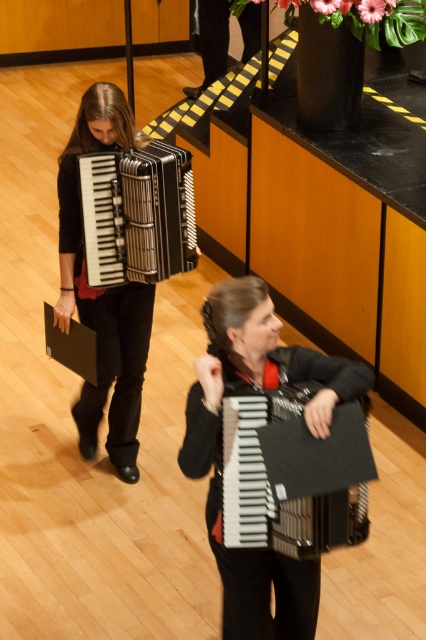
Question: Can you confirm if black matte accordion at center is bigger than matte black accordion at left?

Choices:
 (A) yes
 (B) no

Answer: (B)

Question: Among these objects, which one is nearest to the camera?

Choices:
 (A) black matte accordion at center
 (B) matte black accordion at left
 (C) matte black accordion at center
 (D) metallic silver accordion at center

Answer: (A)

Question: Does black matte accordion at center appear on the left side of metallic silver accordion at center?

Choices:
 (A) yes
 (B) no

Answer: (B)

Question: Which point is closer to the camera taking this photo?

Choices:
 (A) (192, 212)
 (B) (126, 451)
 (C) (195, 384)
 (D) (259, 477)

Answer: (D)

Question: Does black matte accordion at center have a smaller size compared to metallic silver accordion at center?

Choices:
 (A) no
 (B) yes

Answer: (B)

Question: Which object appears farthest from the camera in this image?

Choices:
 (A) metallic silver accordion at center
 (B) matte black accordion at center
 (C) black matte accordion at center

Answer: (A)